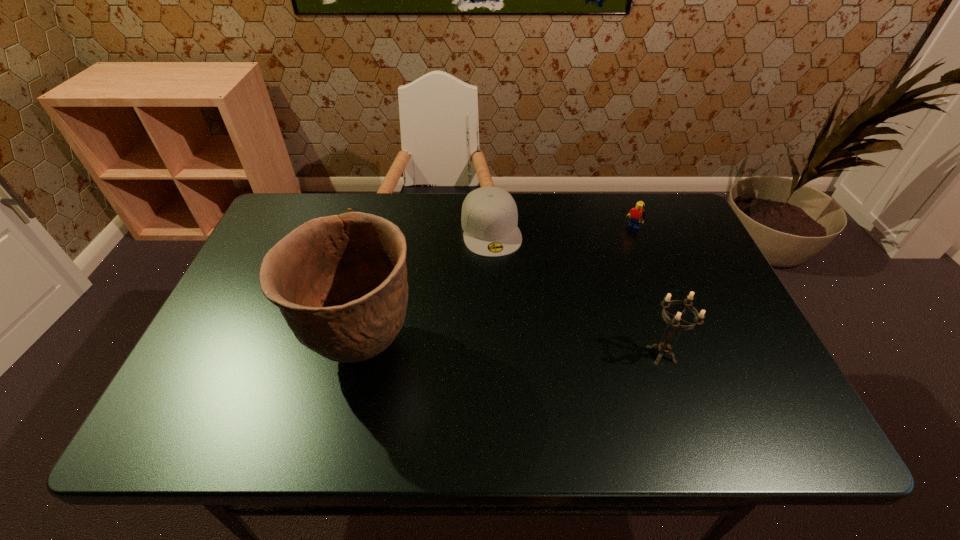
Where is `vacant spot on the desktop that is between the tallest object and the second tallest object and is positioned on the front-facing side of the third object from left to right`? vacant spot on the desktop that is between the tallest object and the second tallest object and is positioned on the front-facing side of the third object from left to right is located at coordinates (520, 350).

This screenshot has height=540, width=960. I want to click on vacant space on the desktop that is between the pottery and the candle holder and is positioned on the front-facing side of the third shortest object, so click(538, 351).

Where is `vacant spot on the desktop that is between the pottery and the second tallest object and is positioned on the front-facing side of the sunglasses`? vacant spot on the desktop that is between the pottery and the second tallest object and is positioned on the front-facing side of the sunglasses is located at coordinates (474, 349).